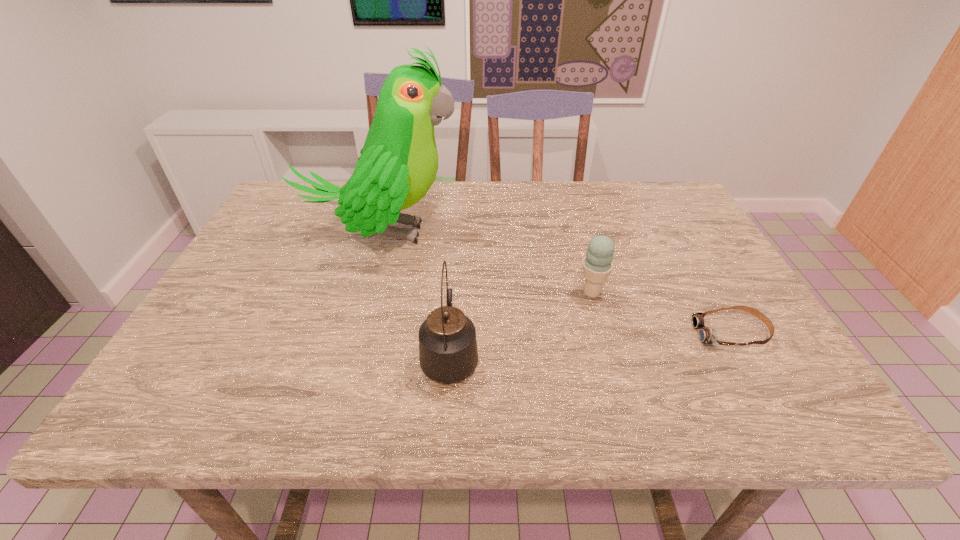
I want to click on free location located spout on the second tallest object, so click(x=454, y=285).

Find the location of a particular element. The height and width of the screenshot is (540, 960). vacant space situated 0.080m on the left of the second shortest object is located at coordinates (542, 293).

Identify the location of vacant space situated 0.060m on the front-facing side of the rightmost object. (667, 334).

At what (x,y) coordinates should I click in order to perform the action: click on vacant region located 0.380m on the front-facing side of the rightmost object. Please return your answer as a coordinate pair (x, y). Looking at the image, I should click on pos(515,334).

At what (x,y) coordinates should I click in order to perform the action: click on free region located on the front-facing side of the rightmost object. Please return your answer as a coordinate pair (x, y). The image size is (960, 540). Looking at the image, I should click on (553, 334).

Locate an element on the screen. This screenshot has height=540, width=960. object present at the far edge is located at coordinates (398, 164).

Identify the location of object that is at the near edge. (448, 353).

The height and width of the screenshot is (540, 960). What are the coordinates of `object that is at the left edge` in the screenshot? It's located at (398, 164).

You are a GUI agent. You are given a task and a screenshot of the screen. Output one action in this format:
    pyautogui.click(x=<x>, y=<y>)
    Task: Click on the object that is at the right edge
    
    Given the screenshot: What is the action you would take?
    pyautogui.click(x=706, y=335)

I want to click on object located in the far left corner section of the desktop, so click(x=398, y=164).